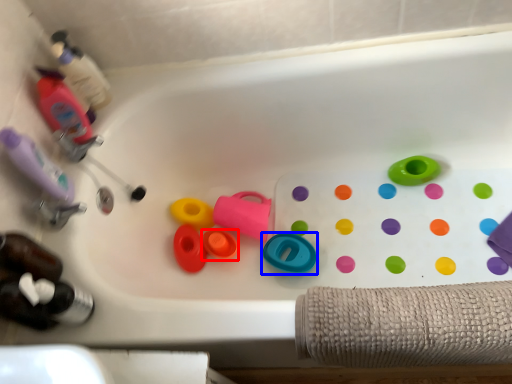
Question: Which object is further to the camera taking this photo, toy (highlighted by a red box) or toy (highlighted by a blue box)?

Choices:
 (A) toy
 (B) toy

Answer: (A)